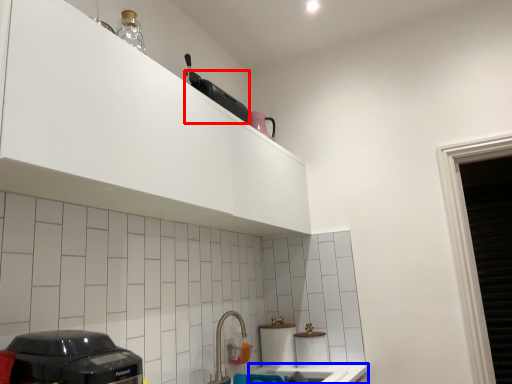
Question: Which of the following is the farthest to the observer, appliance (highlighted by a red box) or counter top (highlighted by a blue box)?

Choices:
 (A) appliance
 (B) counter top

Answer: (A)